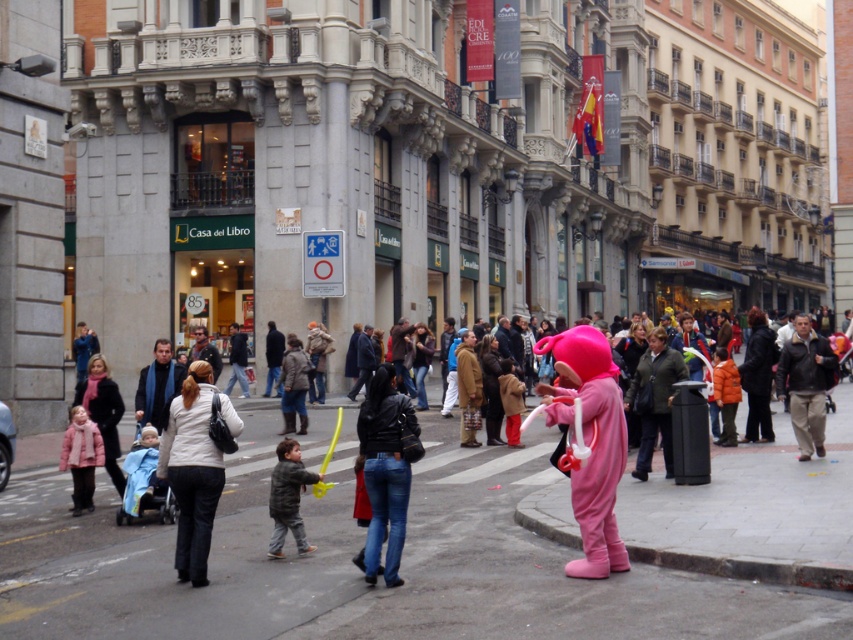
Question: Which of the following is the farthest from the observer?

Choices:
 (A) white matte jacket at center
 (B) pink fabric costume at center
 (C) dark gray jacket at center
 (D) black leather jacket at center

Answer: (C)

Question: Where is white matte jacket at center located in relation to brown leather jacket at right in the image?

Choices:
 (A) below
 (B) above

Answer: (A)

Question: Is pink fabric costume at center bigger than pink plush costume at center?

Choices:
 (A) yes
 (B) no

Answer: (A)

Question: Which is farther from the brown leather jacket at right?

Choices:
 (A) pink fabric costume at center
 (B) pink plush costume at center
 (C) dark gray jacket at center

Answer: (C)

Question: Does dark gray jacket at center have a larger size compared to matte pink coat at lower left?

Choices:
 (A) yes
 (B) no

Answer: (B)

Question: Among these objects, which one is nearest to the camera?

Choices:
 (A) white matte jacket at center
 (B) brown leather jacket at right

Answer: (A)